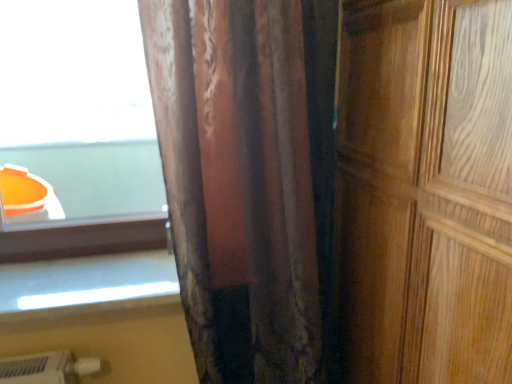
Describe the element at coordinates (84, 283) in the screenshot. I see `white glossy window sill at lower left` at that location.

What do you see at coordinates (426, 190) in the screenshot?
I see `wooden door at right` at bounding box center [426, 190].

You are a GUI agent. You are given a task and a screenshot of the screen. Output one action in this format:
    pyautogui.click(x=<x>, y=<y>)
    Task: Click on the white glossy window sill at lower left
    This screenshot has width=512, height=384.
    Given the screenshot: What is the action you would take?
    pyautogui.click(x=84, y=283)

Which object is wider, wooden door at right or velvet-like brown curtain at center?

With larger width is wooden door at right.

Visually, is wooden door at right positioned to the left or to the right of velvet-like brown curtain at center?

Based on their positions, wooden door at right is located to the right of velvet-like brown curtain at center.

Which is closer to the camera, (470,124) or (316,242)?

Clearly, point (470,124) is closer to the camera than point (316,242).

From the image's perspective, is wooden door at right located above velvet-like brown curtain at center?

No.

Which is behind, point (366, 13) or point (86, 299)?

The point (86, 299) is more distant.

Is wooden door at right outside of white glossy window sill at lower left?

Yes.

From a real-world perspective, which object rests below the other?

white glossy window sill at lower left, from a real-world perspective.

Considering the relative sizes of wooden door at right and white glossy window sill at lower left in the image provided, is wooden door at right bigger than white glossy window sill at lower left?

Yes, wooden door at right is bigger than white glossy window sill at lower left.

Who is smaller, velvet-like brown curtain at center or wooden door at right?

velvet-like brown curtain at center.

Which of these two, velvet-like brown curtain at center or wooden door at right, stands taller?

wooden door at right.

From the image's perspective, is velvet-like brown curtain at center beneath wooden door at right?

No, from the image's perspective, velvet-like brown curtain at center is not beneath wooden door at right.

Is velvet-like brown curtain at center to the right of wooden door at right from the viewer's perspective?

No, velvet-like brown curtain at center is not to the right of wooden door at right.

You are a GUI agent. You are given a task and a screenshot of the screen. Output one action in this format:
    pyautogui.click(x=<x>, y=<y>)
    Task: Click on the door located on the right of white glossy window sill at lower left
    The image size is (512, 384).
    Given the screenshot: What is the action you would take?
    pyautogui.click(x=426, y=190)

Does white glossy window sill at lower left have a lesser height compared to wooden door at right?

Yes.

Which is behind, white glossy window sill at lower left or wooden door at right?

white glossy window sill at lower left is more distant.

From a real-world perspective, is white glossy window sill at lower left positioned under wooden door at right based on gravity?

Yes, from a real-world perspective, white glossy window sill at lower left is beneath wooden door at right.

Would you say velvet-like brown curtain at center is to the left or to the right of white glossy window sill at lower left in the picture?

From the image, it's evident that velvet-like brown curtain at center is to the right of white glossy window sill at lower left.

Does velvet-like brown curtain at center have a lesser height compared to white glossy window sill at lower left?

No, velvet-like brown curtain at center is not shorter than white glossy window sill at lower left.

At what (x,y) coordinates should I click in order to perform the action: click on window sill behind the velvet-like brown curtain at center. Please return your answer as a coordinate pair (x, y). The image size is (512, 384). Looking at the image, I should click on (84, 283).

From a real-world perspective, is velvet-like brown curtain at center positioned under white glossy window sill at lower left based on gravity?

No.

Would you consider white glossy window sill at lower left to be distant from velvet-like brown curtain at center?

white glossy window sill at lower left is actually quite close to velvet-like brown curtain at center.

Is white glossy window sill at lower left surrounding velvet-like brown curtain at center?

No, white glossy window sill at lower left does not contain velvet-like brown curtain at center.

From the image's perspective, which object appears higher, white glossy window sill at lower left or velvet-like brown curtain at center?

velvet-like brown curtain at center, from the image's perspective.

The height and width of the screenshot is (384, 512). In order to click on door below the velvet-like brown curtain at center (from a real-world perspective) in this screenshot , I will do `click(426, 190)`.

Identify the location of window sill on the left of the wooden door at right. The width and height of the screenshot is (512, 384). (84, 283).

Considering their positions, is wooden door at right positioned closer to white glossy window sill at lower left than velvet-like brown curtain at center?

velvet-like brown curtain at center is positioned closer to the anchor white glossy window sill at lower left.

Based on their spatial positions, is white glossy window sill at lower left or velvet-like brown curtain at center closer to wooden door at right?

The object closer to wooden door at right is velvet-like brown curtain at center.

From the image, which object appears to be farther from velvet-like brown curtain at center, white glossy window sill at lower left or wooden door at right?

white glossy window sill at lower left.

Considering their positions, is velvet-like brown curtain at center positioned closer to white glossy window sill at lower left than wooden door at right?

The object closer to white glossy window sill at lower left is velvet-like brown curtain at center.

When comparing their distances from wooden door at right, does velvet-like brown curtain at center or white glossy window sill at lower left seem closer?

velvet-like brown curtain at center is closer to wooden door at right.

When comparing their distances from velvet-like brown curtain at center, does wooden door at right or white glossy window sill at lower left seem closer?

wooden door at right lies closer to velvet-like brown curtain at center than the other object.

Where is `curtain situated between white glossy window sill at lower left and wooden door at right from left to right`? Image resolution: width=512 pixels, height=384 pixels. curtain situated between white glossy window sill at lower left and wooden door at right from left to right is located at coordinates (338, 186).